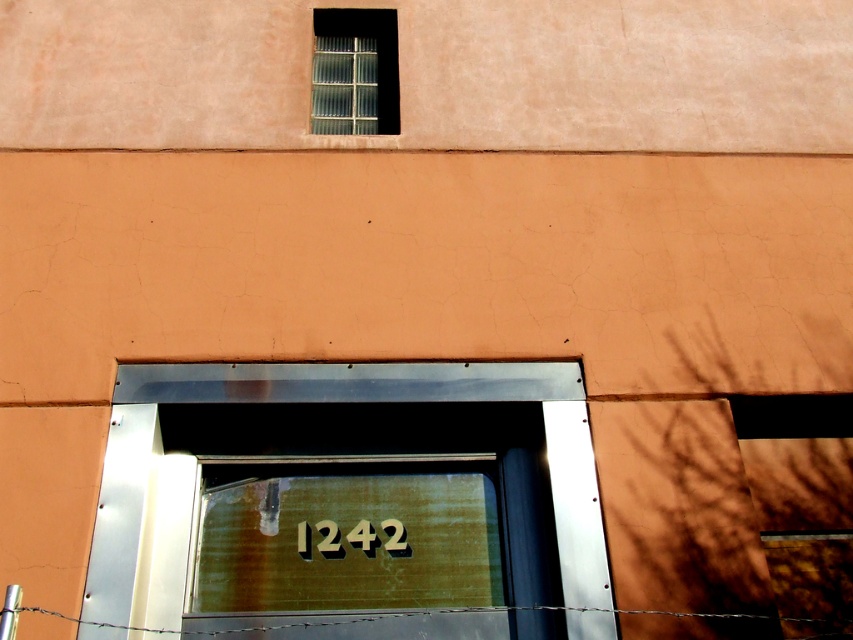
Question: Is clear glass window at upper center to the left of barbed wire at bottom from the viewer's perspective?

Choices:
 (A) no
 (B) yes

Answer: (B)

Question: Which of the following is the farthest from the observer?

Choices:
 (A) clear glass window at upper center
 (B) barbed wire at bottom
 (C) wooden sign at center

Answer: (A)

Question: Which point is farther to the camera?

Choices:
 (A) (354, 525)
 (B) (695, 612)
 (C) (352, 38)

Answer: (C)

Question: Can you confirm if wooden sign at center is smaller than barbed wire at bottom?

Choices:
 (A) yes
 (B) no

Answer: (B)

Question: Is clear glass window at upper center wider than wooden sign at center?

Choices:
 (A) yes
 (B) no

Answer: (B)

Question: Which object appears farthest from the camera in this image?

Choices:
 (A) wooden sign at center
 (B) barbed wire at bottom
 (C) clear glass window at upper center

Answer: (C)